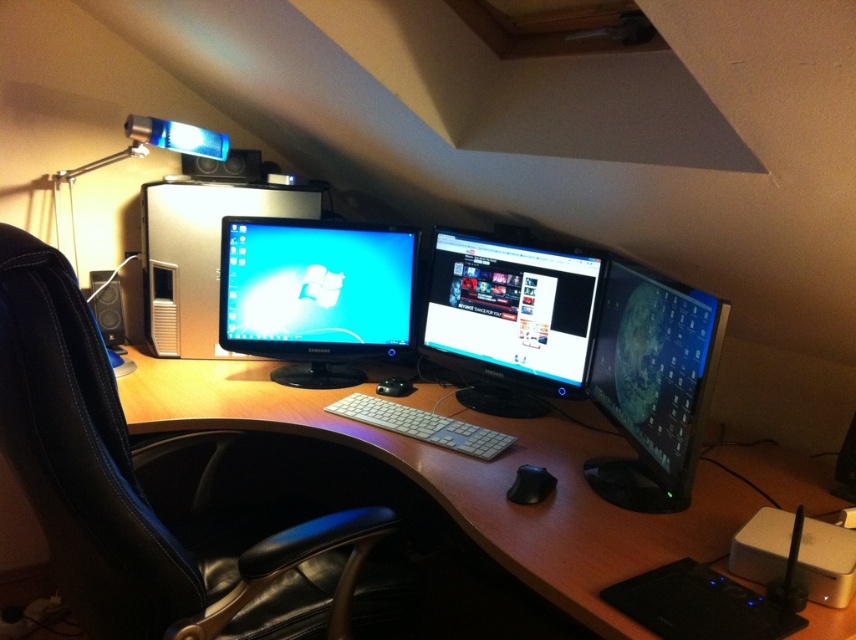
Consider the image. You are sitting in the black leather swivel chair at left and want to reach the white plastic keyboard at center. Is the keyboard within easy reach from your current position?

The black leather swivel chair at left is in front of the white plastic keyboard at center, so yes, the keyboard is within easy reach from your current position.

In the scene shown: You are working in this home office and need to reach both the satin black monitor at center and the black rubber mouse at center. Which object is positioned to the right of the other?

The satin black monitor at center is to the right of the black rubber mouse at center.